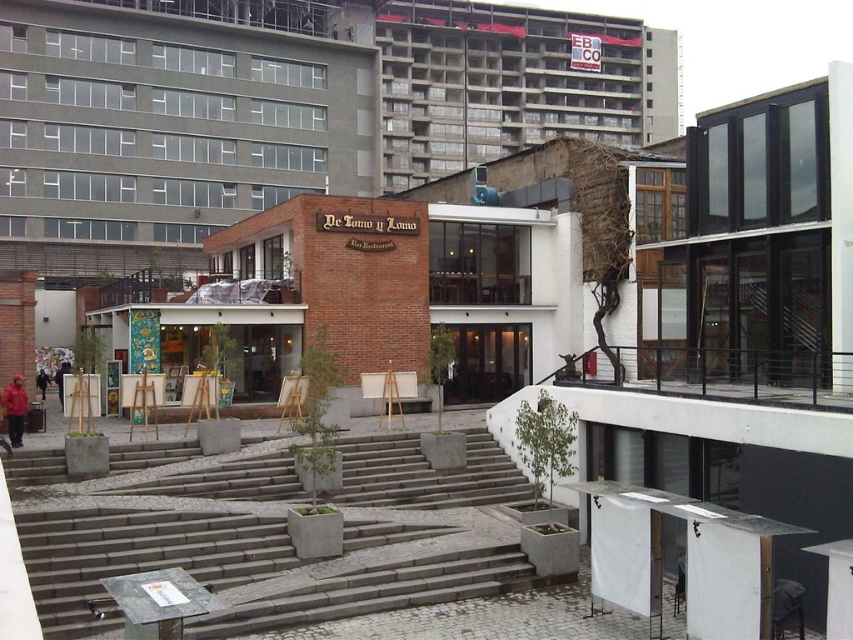
Can you confirm if gray concrete stairs at center is taller than wooden easel at center?

Correct, gray concrete stairs at center is much taller as wooden easel at center.

Does point (337, 589) lie in front of point (296, 394)?

Yes, point (337, 589) is in front of point (296, 394).

Is point (32, 557) in front of point (287, 412)?

Yes, point (32, 557) is closer to viewer.

Where is `gray concrete stairs at center`? The image size is (853, 640). gray concrete stairs at center is located at coordinates (270, 532).